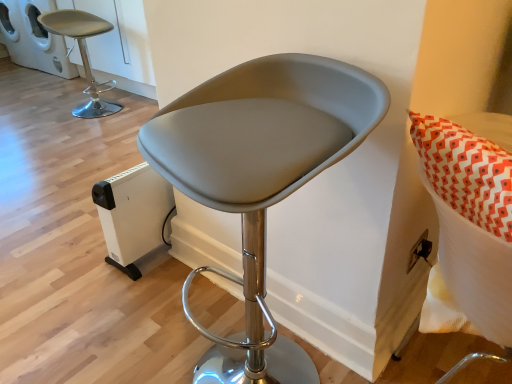
The image size is (512, 384). Describe the element at coordinates (45, 40) in the screenshot. I see `white plastic cat house at upper left, the 1th appliance viewed from the left` at that location.

Describe the element at coordinates (133, 215) in the screenshot. I see `white plastic heater at lower left, which is the 2th appliance from left to right` at that location.

Identify the location of matte gray stool at upper left, which is the 1th chair in back-to-front order. This screenshot has height=384, width=512. (83, 55).

The height and width of the screenshot is (384, 512). I want to click on matte gray stool at center, which is counted as the second chair, starting from the left, so click(260, 176).

Which of these two, white plastic cat house at upper left, which is the 2th appliance in bottom-to-top order, or matte gray stool at center, which is counted as the second chair, starting from the left, is wider?

white plastic cat house at upper left, which is the 2th appliance in bottom-to-top order, is wider.

Which of these two, white plastic cat house at upper left, which is the first appliance in back-to-front order, or matte gray stool at center, acting as the 1th chair starting from the bottom, is smaller?

With smaller size is matte gray stool at center, acting as the 1th chair starting from the bottom.

From the image's perspective, is white plastic cat house at upper left, the second appliance when ordered from front to back, under matte gray stool at center, marked as the 1th chair in a right-to-left arrangement?

Actually, white plastic cat house at upper left, the second appliance when ordered from front to back, appears above matte gray stool at center, marked as the 1th chair in a right-to-left arrangement, in the image.

Would you say matte gray stool at center, acting as the 1th chair starting from the bottom, is part of white plastic cat house at upper left, the 1th appliance viewed from the left,'s contents?

No, matte gray stool at center, acting as the 1th chair starting from the bottom, is located outside of white plastic cat house at upper left, the 1th appliance viewed from the left.

Is white plastic heater at lower left, the first appliance positioned from the front, in front of white plastic cat house at upper left, arranged as the 1th appliance when viewed from the top?

Yes.

Does white plastic heater at lower left, acting as the 1th appliance starting from the bottom, have a larger size compared to white plastic cat house at upper left, which is the 2th appliance in bottom-to-top order?

No.

What's the angular difference between white plastic heater at lower left, which is the 2th appliance from left to right, and white plastic cat house at upper left, arranged as the 1th appliance when viewed from the top,'s facing directions?

90.3 degrees.

Considering the positions of point (120, 236) and point (25, 7), is point (120, 236) closer or farther from the camera than point (25, 7)?

Point (120, 236) is closer to the camera than point (25, 7).

Considering the sizes of objects matte gray stool at center, the second chair when ordered from top to bottom, and white plastic heater at lower left, which is the 2th appliance from left to right, in the image provided, who is shorter, matte gray stool at center, the second chair when ordered from top to bottom, or white plastic heater at lower left, which is the 2th appliance from left to right,?

white plastic heater at lower left, which is the 2th appliance from left to right, is shorter.

From the image's perspective, is matte gray stool at center, which is the 1th chair in front-to-back order, located above or below white plastic heater at lower left, placed as the second appliance when sorted from top to bottom?

matte gray stool at center, which is the 1th chair in front-to-back order, is below white plastic heater at lower left, placed as the second appliance when sorted from top to bottom.

From the picture: In the image, is matte gray stool at center, the second chair when ordered from top to bottom, on the left side or the right side of white plastic heater at lower left, acting as the 1th appliance starting from the bottom?

matte gray stool at center, the second chair when ordered from top to bottom, is to the right of white plastic heater at lower left, acting as the 1th appliance starting from the bottom.

Is matte gray stool at center, the second chair when ordered from top to bottom, surrounding white plastic heater at lower left, the first appliance positioned from the front?

No, matte gray stool at center, the second chair when ordered from top to bottom, does not contain white plastic heater at lower left, the first appliance positioned from the front.

From a real-world perspective, relative to matte gray stool at upper left, acting as the 2th chair starting from the front, is matte gray stool at center, which appears as the 2th chair when viewed from the back, vertically above or below?

In terms of real-world spatial position, matte gray stool at center, which appears as the 2th chair when viewed from the back, is above matte gray stool at upper left, acting as the 2th chair starting from the front.

Measure the distance between matte gray stool at center, which is counted as the second chair, starting from the left, and matte gray stool at upper left, positioned as the second chair in bottom-to-top order.

matte gray stool at center, which is counted as the second chair, starting from the left, is 2.67 meters away from matte gray stool at upper left, positioned as the second chair in bottom-to-top order.

In the image, is matte gray stool at center, which is counted as the second chair, starting from the left, on the left side or the right side of matte gray stool at upper left, which is the 1th chair in back-to-front order?

From the image, it's evident that matte gray stool at center, which is counted as the second chair, starting from the left, is to the right of matte gray stool at upper left, which is the 1th chair in back-to-front order.

From the image's perspective, is matte gray stool at center, which is the 1th chair in front-to-back order, located beneath matte gray stool at upper left, placed as the 1th chair when sorted from left to right?

Yes, from the image's perspective, matte gray stool at center, which is the 1th chair in front-to-back order, is below matte gray stool at upper left, placed as the 1th chair when sorted from left to right.

From the image's perspective, which one is positioned lower, matte gray stool at center, which appears as the 2th chair when viewed from the back, or white plastic cat house at upper left, which is the 2th appliance in bottom-to-top order?

matte gray stool at center, which appears as the 2th chair when viewed from the back, from the image's perspective.

Consider the image. Is matte gray stool at center, acting as the 1th chair starting from the bottom, situated inside white plastic cat house at upper left, the 1th appliance viewed from the left, or outside?

matte gray stool at center, acting as the 1th chair starting from the bottom, lies outside white plastic cat house at upper left, the 1th appliance viewed from the left.

Which object is closer to the camera taking this photo, matte gray stool at center, which is counted as the second chair, starting from the left, or white plastic cat house at upper left, the second appliance from the right?

Positioned in front is matte gray stool at center, which is counted as the second chair, starting from the left.

In the image, is matte gray stool at center, which appears as the 2th chair when viewed from the back, on the left side or the right side of white plastic cat house at upper left, the 1th appliance viewed from the left?

matte gray stool at center, which appears as the 2th chair when viewed from the back, is to the right of white plastic cat house at upper left, the 1th appliance viewed from the left.

Does white plastic heater at lower left, marked as the 1th appliance in a right-to-left arrangement, have a larger size compared to matte gray stool at upper left, positioned as the second chair in bottom-to-top order?

No, white plastic heater at lower left, marked as the 1th appliance in a right-to-left arrangement, is not bigger than matte gray stool at upper left, positioned as the second chair in bottom-to-top order.

Which object is thinner, white plastic heater at lower left, acting as the 1th appliance starting from the bottom, or matte gray stool at upper left, which is the 1th chair in back-to-front order?

white plastic heater at lower left, acting as the 1th appliance starting from the bottom, is thinner.

How distant is white plastic heater at lower left, placed as the second appliance when sorted from top to bottom, from matte gray stool at upper left, the 1th chair positioned from the top?

white plastic heater at lower left, placed as the second appliance when sorted from top to bottom, and matte gray stool at upper left, the 1th chair positioned from the top, are 1.89 meters apart from each other.

Is there a large distance between matte gray stool at upper left, which is the 1th chair in back-to-front order, and matte gray stool at center, which is the 1th chair in front-to-back order?

Yes.

Which is closer to the camera, (79, 107) or (194, 199)?

Positioned in front is point (194, 199).

Looking at this image, is matte gray stool at upper left, placed as the 1th chair when sorted from left to right, aimed at matte gray stool at center, which is the 1th chair in front-to-back order?

No, matte gray stool at upper left, placed as the 1th chair when sorted from left to right, is not aimed at matte gray stool at center, which is the 1th chair in front-to-back order.

Considering the relative positions of matte gray stool at upper left, the 1th chair positioned from the top, and matte gray stool at center, which appears as the 2th chair when viewed from the back, in the image provided, is matte gray stool at upper left, the 1th chair positioned from the top, to the right of matte gray stool at center, which appears as the 2th chair when viewed from the back, from the viewer's perspective?

In fact, matte gray stool at upper left, the 1th chair positioned from the top, is to the left of matte gray stool at center, which appears as the 2th chair when viewed from the back.

From a real-world perspective, which appliance is the 1st one underneath the matte gray stool at center, the second chair when ordered from top to bottom? Please provide its 2D coordinates.

[(45, 40)]

Where is `appliance lying on the left of white plastic heater at lower left, which is counted as the 2th appliance, starting from the back`? The image size is (512, 384). appliance lying on the left of white plastic heater at lower left, which is counted as the 2th appliance, starting from the back is located at coordinates (45, 40).

Considering their positions, is white plastic heater at lower left, marked as the 1th appliance in a right-to-left arrangement, positioned closer to matte gray stool at upper left, positioned as the second chair in bottom-to-top order, than matte gray stool at center, marked as the 1th chair in a right-to-left arrangement?

The object closer to matte gray stool at upper left, positioned as the second chair in bottom-to-top order, is white plastic heater at lower left, marked as the 1th appliance in a right-to-left arrangement.

Considering their positions, is white plastic cat house at upper left, the 1th appliance viewed from the left, positioned closer to matte gray stool at center, which is counted as the second chair, starting from the left, than white plastic heater at lower left, placed as the second appliance when sorted from top to bottom?

white plastic heater at lower left, placed as the second appliance when sorted from top to bottom.

Which object lies further to the anchor point white plastic heater at lower left, which is counted as the 2th appliance, starting from the back, matte gray stool at upper left, which is the 1th chair in back-to-front order, or matte gray stool at center, which is the 1th chair in front-to-back order?

matte gray stool at upper left, which is the 1th chair in back-to-front order, is positioned further to the anchor white plastic heater at lower left, which is counted as the 2th appliance, starting from the back.

From the image, which object appears to be nearer to matte gray stool at center, marked as the 1th chair in a right-to-left arrangement, white plastic cat house at upper left, arranged as the 1th appliance when viewed from the top, or matte gray stool at upper left, which appears as the 2th chair when viewed from the right?

The object closer to matte gray stool at center, marked as the 1th chair in a right-to-left arrangement, is matte gray stool at upper left, which appears as the 2th chair when viewed from the right.

When comparing their distances from white plastic heater at lower left, which is the 2th appliance from left to right, does matte gray stool at center, acting as the 1th chair starting from the bottom, or matte gray stool at upper left, which is the 1th chair in back-to-front order, seem further?

matte gray stool at upper left, which is the 1th chair in back-to-front order, lies further to white plastic heater at lower left, which is the 2th appliance from left to right, than the other object.

Looking at the image, which one is located further to white plastic cat house at upper left, which is the first appliance in back-to-front order, matte gray stool at upper left, positioned as the second chair in bottom-to-top order, or matte gray stool at center, marked as the 1th chair in a right-to-left arrangement?

Based on the image, matte gray stool at center, marked as the 1th chair in a right-to-left arrangement, appears to be further to white plastic cat house at upper left, which is the first appliance in back-to-front order.

Which object lies further to the anchor point white plastic heater at lower left, the first appliance positioned from the front, white plastic cat house at upper left, the second appliance when ordered from front to back, or matte gray stool at upper left, acting as the 2th chair starting from the front?

white plastic cat house at upper left, the second appliance when ordered from front to back, lies further to white plastic heater at lower left, the first appliance positioned from the front, than the other object.

In the scene shown: Considering their positions, is white plastic heater at lower left, which is the 2th appliance from left to right, positioned further to matte gray stool at center, which is counted as the second chair, starting from the left, than white plastic cat house at upper left, the 1th appliance viewed from the left?

white plastic cat house at upper left, the 1th appliance viewed from the left, is positioned further to the anchor matte gray stool at center, which is counted as the second chair, starting from the left.

You are a GUI agent. You are given a task and a screenshot of the screen. Output one action in this format:
    pyautogui.click(x=<x>, y=<y>)
    Task: Click on the appliance between matte gray stool at center, the second chair when ordered from top to bottom, and matte gray stool at upper left, the 1th chair positioned from the top, from front to back
    
    Given the screenshot: What is the action you would take?
    pyautogui.click(x=133, y=215)

This screenshot has height=384, width=512. I want to click on chair between matte gray stool at center, the second chair when ordered from top to bottom, and white plastic cat house at upper left, arranged as the 1th appliance when viewed from the top, along the z-axis, so click(x=83, y=55).

I want to click on appliance located between matte gray stool at center, acting as the 1th chair starting from the bottom, and white plastic cat house at upper left, arranged as the 1th appliance when viewed from the top, in the depth direction, so click(x=133, y=215).

Where is `chair located between white plastic heater at lower left, acting as the 1th appliance starting from the bottom, and white plastic cat house at upper left, which is the first appliance in back-to-front order, in the depth direction`? The width and height of the screenshot is (512, 384). chair located between white plastic heater at lower left, acting as the 1th appliance starting from the bottom, and white plastic cat house at upper left, which is the first appliance in back-to-front order, in the depth direction is located at coordinates (83, 55).